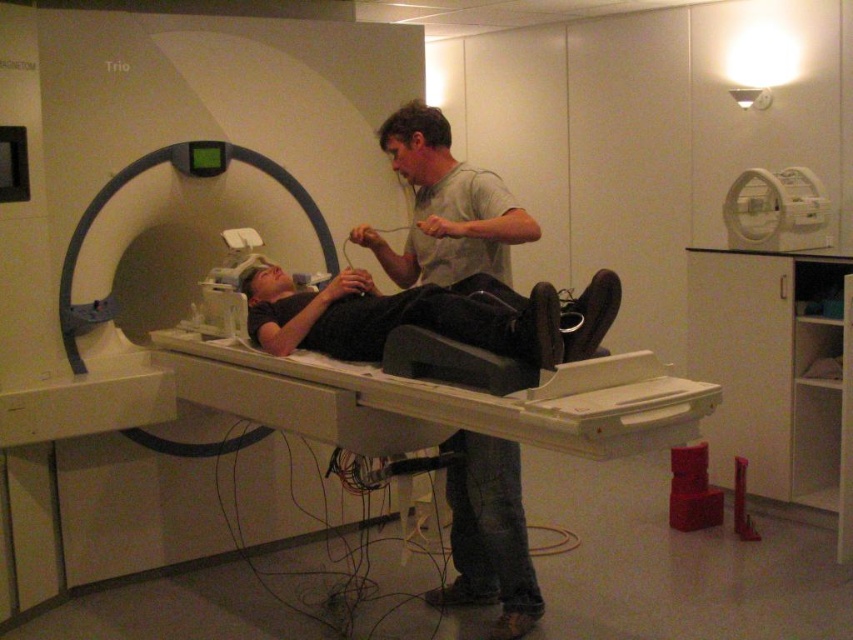
Question: Among these objects, which one is farthest from the camera?

Choices:
 (A) white plastic scanner at upper right
 (B) gray cotton shirt at center

Answer: (A)

Question: Is the position of black matte patient at center less distant than that of white plastic scanner at upper right?

Choices:
 (A) no
 (B) yes

Answer: (B)

Question: In this image, where is black matte patient at center located relative to white plastic scanner at upper right?

Choices:
 (A) right
 (B) left

Answer: (B)

Question: Which of the following is the farthest from the observer?

Choices:
 (A) black matte patient at center
 (B) matte black mri bed at center
 (C) white plastic scanner at upper right

Answer: (C)

Question: Which object is the closest to the white plastic scanner at upper right?

Choices:
 (A) black matte patient at center
 (B) matte black mri bed at center
 (C) gray cotton shirt at center

Answer: (C)

Question: Does gray cotton shirt at center have a smaller size compared to white plastic scanner at upper right?

Choices:
 (A) no
 (B) yes

Answer: (A)